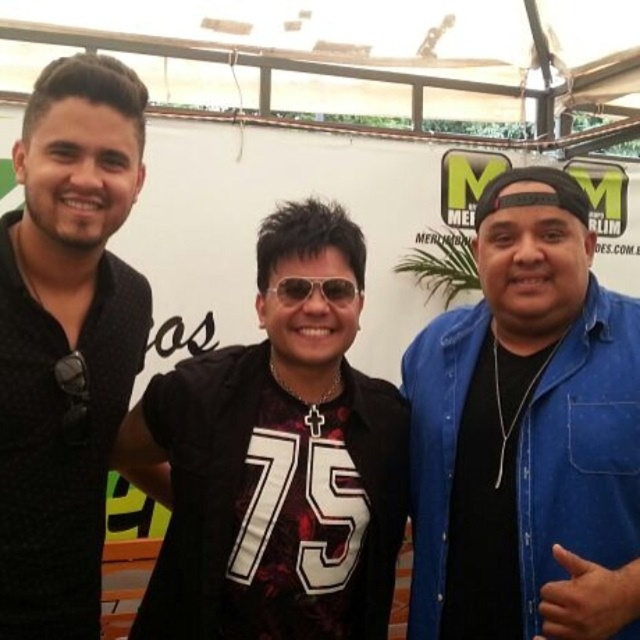
Question: Among these objects, which one is nearest to the camera?

Choices:
 (A) blue denim shirt at right
 (B) sunglasses at center
 (C) black matte shirt at left

Answer: (A)

Question: Which of these objects is positioned closest to the sunglasses at center?

Choices:
 (A) black matte sunglasses at center
 (B) black matte shirt at left

Answer: (A)

Question: Based on their relative distances, which object is farther from the sunglasses at center?

Choices:
 (A) black matte sunglasses at center
 (B) blue denim shirt at right

Answer: (B)

Question: Is blue denim shirt at right smaller than sunglasses at center?

Choices:
 (A) no
 (B) yes

Answer: (A)

Question: Can you confirm if black matte shirt at left is wider than sunglasses at center?

Choices:
 (A) no
 (B) yes

Answer: (B)

Question: Does blue denim shirt at right appear over black matte shirt at left?

Choices:
 (A) yes
 (B) no

Answer: (B)